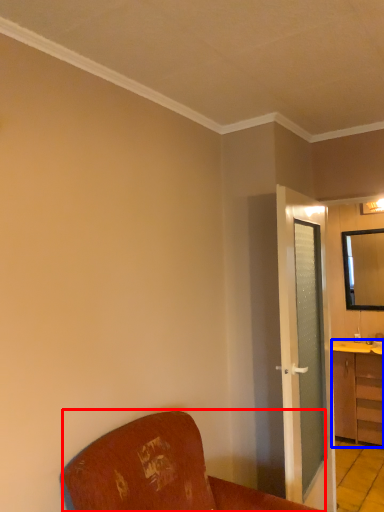
Question: Which object is closer to the camera taking this photo, furniture (highlighted by a red box) or cabinetry (highlighted by a blue box)?

Choices:
 (A) furniture
 (B) cabinetry

Answer: (A)